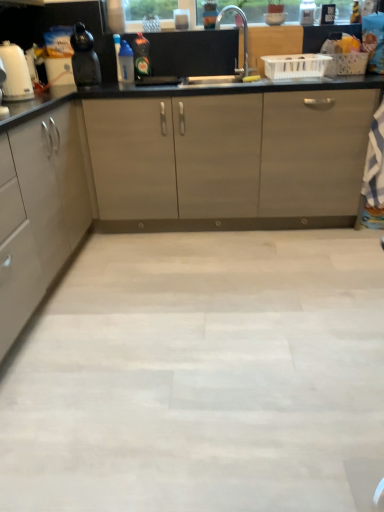
Question: Which direction should I rotate to look at green glass bottle at center, acting as the 1th bottle starting from the right?

Choices:
 (A) right
 (B) left

Answer: (B)

Question: Is matte black kettle at left wider than green glass bottle at center, the 2th bottle positioned from the left?

Choices:
 (A) yes
 (B) no

Answer: (A)

Question: Does matte black kettle at left touch green glass bottle at center, the 2th bottle positioned from the left?

Choices:
 (A) yes
 (B) no

Answer: (B)

Question: From a real-world perspective, is matte black kettle at left on top of green glass bottle at center, acting as the 1th bottle starting from the right?

Choices:
 (A) no
 (B) yes

Answer: (B)

Question: Can you confirm if matte black kettle at left is shorter than green glass bottle at center, acting as the 1th bottle starting from the right?

Choices:
 (A) yes
 (B) no

Answer: (B)

Question: Considering the relative sizes of matte black kettle at left and green glass bottle at center, acting as the 1th bottle starting from the right, in the image provided, is matte black kettle at left taller than green glass bottle at center, acting as the 1th bottle starting from the right,?

Choices:
 (A) yes
 (B) no

Answer: (A)

Question: Does matte black kettle at left contain green glass bottle at center, the 2th bottle positioned from the left?

Choices:
 (A) yes
 (B) no

Answer: (B)

Question: Can you confirm if matte gray cabinet at left is wider than silver metallic faucet at upper center?

Choices:
 (A) yes
 (B) no

Answer: (A)

Question: From a real-world perspective, does matte gray cabinet at left stand above silver metallic faucet at upper center?

Choices:
 (A) no
 (B) yes

Answer: (A)

Question: Is matte gray cabinet at left oriented away from silver metallic faucet at upper center?

Choices:
 (A) yes
 (B) no

Answer: (B)

Question: Considering the relative sizes of matte gray cabinet at left and silver metallic faucet at upper center in the image provided, is matte gray cabinet at left taller than silver metallic faucet at upper center?

Choices:
 (A) yes
 (B) no

Answer: (A)

Question: Can you confirm if matte gray cabinet at left is positioned to the right of silver metallic faucet at upper center?

Choices:
 (A) no
 (B) yes

Answer: (A)

Question: Can we say matte gray cabinet at left lies outside silver metallic faucet at upper center?

Choices:
 (A) yes
 (B) no

Answer: (A)

Question: From the image's perspective, is matte black kettle at left below white glossy kettle at left?

Choices:
 (A) no
 (B) yes

Answer: (A)